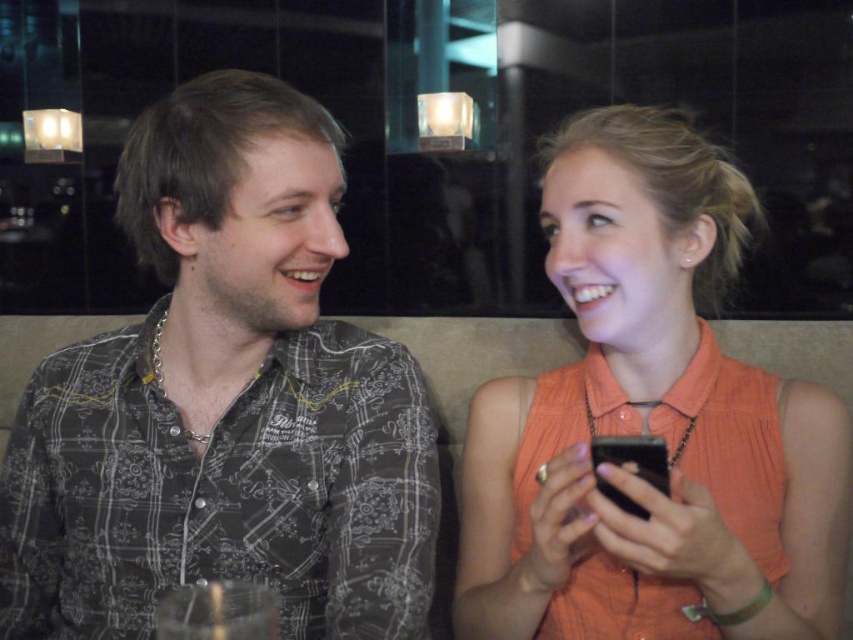
You are a photographer trying to capture a candid shot of the two people in the scene. You notice the orange fabric shirt at center and the matte black smartphone at center. Which object is positioned higher in the frame?

A: The orange fabric shirt at center is located above the matte black smartphone at center, so it is positioned higher in the frame.

You are a fashion designer observing two individuals in a cafe. You notice the dark gray printed shirt at left and the orange fabric shirt at center. Which shirt has a greater width?

The dark gray printed shirt at left has a greater width than the orange fabric shirt at center.

You are taking a photo of two people sitting at a table in a cafe. You want to focus on the person at point (131, 326) and the person at point (590, 448). Which person will be in focus if you focus on the closer one?

The person at point (131, 326) will be in focus because it is closer to the camera than the person at point (590, 448).